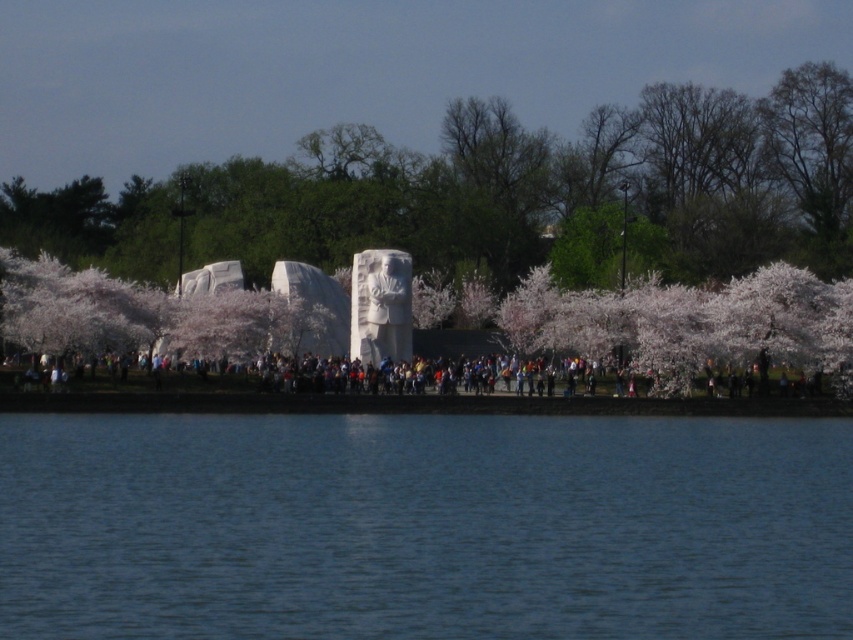
You are planning to take a photo of the blue water at lower center and the white stone sculpture at center from a position that allows both to be in the frame. Based on their sizes, which object should you focus on first to ensure both are fully visible?

The blue water at lower center is smaller than the white stone sculpture at center, so you should focus on the white stone sculpture at center first to ensure both are fully visible.

You are a photographer planning to take a photo of the blue water at lower center and the multicolored clothing at center. Which object should you focus on first if you want to capture both in a single frame without moving the camera?

The blue water at lower center has a larger size compared to multicolored clothing at center, so you should focus on the blue water at lower center first to ensure it fills the frame appropriately before adjusting for the smaller multicolored clothing at center.

You are a photographer trying to capture a clear shot of the white stone sculpture at center without the multicolored clothing at center blocking it. Based on the scene, can you position yourself in a way to achieve this?

The white stone sculpture at center is positioned over multicolored clothing at center, so you can position yourself lower to shoot upwards to avoid the clothing blocking the view.